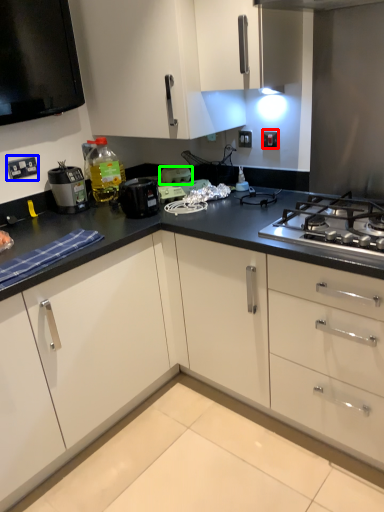
Question: Estimate the real-world distances between objects in this image. Which object is farther from electric outlet (highlighted by a red box), electric outlet (highlighted by a blue box) or appliance (highlighted by a green box)?

Choices:
 (A) electric outlet
 (B) appliance

Answer: (A)